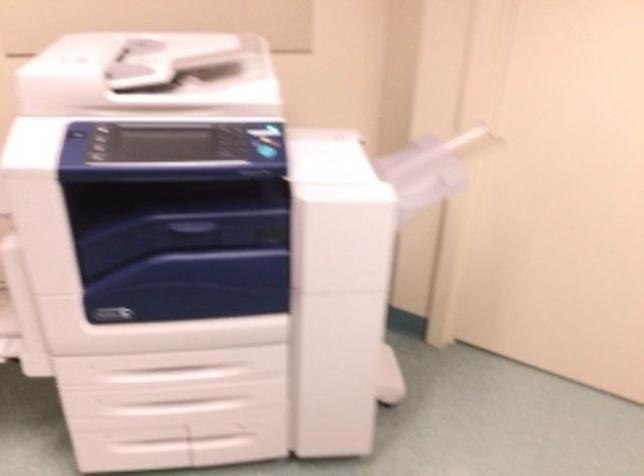
The width and height of the screenshot is (644, 476). What do you see at coordinates (196, 231) in the screenshot?
I see `a blue printer tray handle` at bounding box center [196, 231].